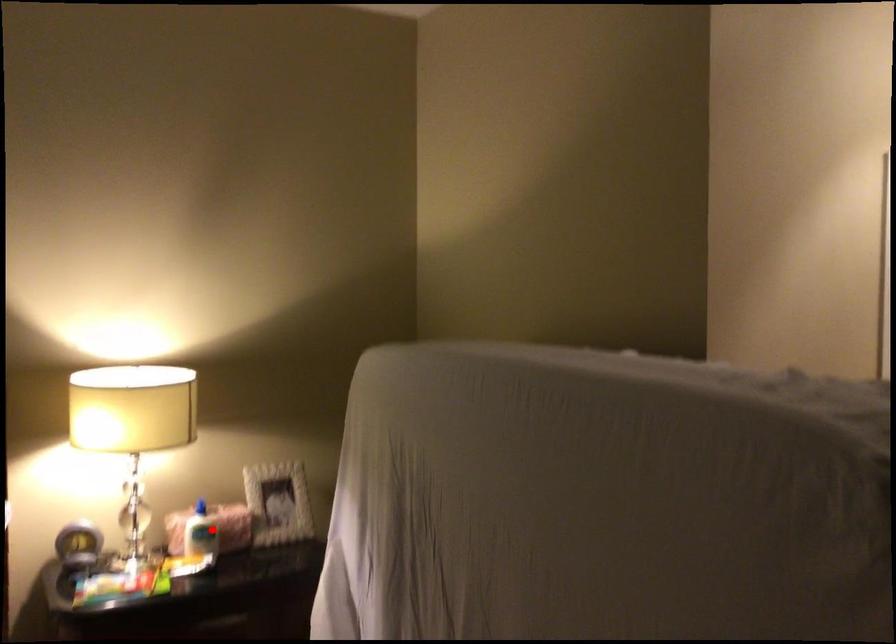
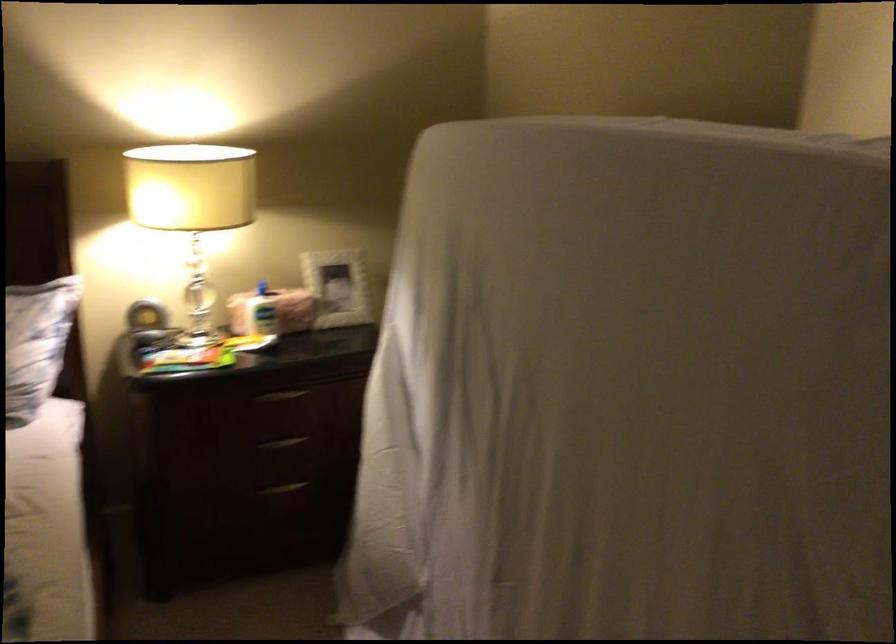
In the second image, find the point that corresponds to the highlighted location in the first image.

(273, 310)